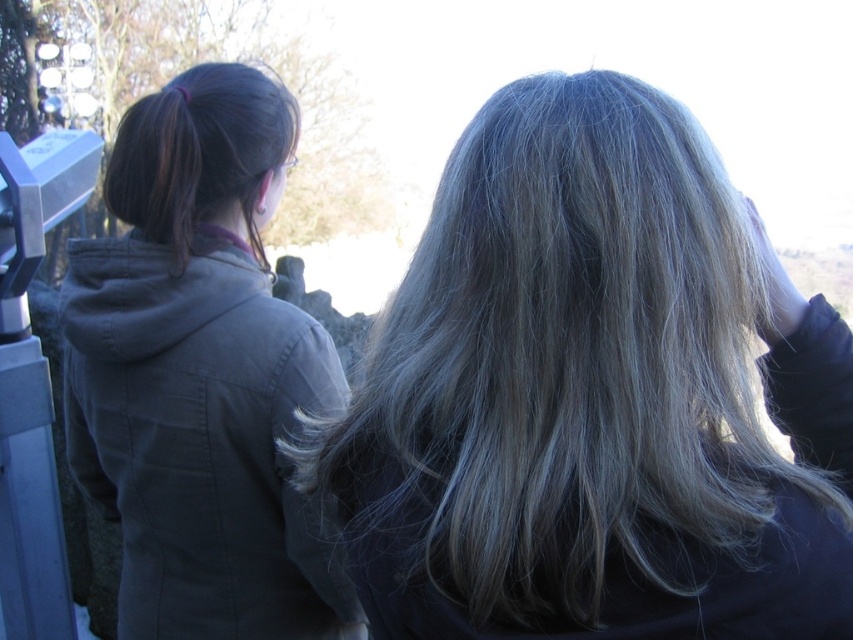
You are a photographer trying to capture a closeup of the dark gray hoodie at left and the dark brown silky hair at upper left. Which object should you focus on first to ensure both are in focus?

The dark gray hoodie at left is closer to the viewer than the dark brown silky hair at upper left, so you should focus on the dark gray hoodie at left first to ensure both are in focus.

You are a photographer adjusting your camera settings to focus on two points in the image. The first point is point (300,333) and the second is point (209,100). Since you can only focus on one point at a time, which point should you choose to ensure the closer one is sharp?

Point (300,333) is closer to the camera than point (209,100), so you should focus on point (300,333) to ensure the closer one is sharp.

You are a photographer adjusting your camera to focus on two points in the image. The first point is at coordinates point (688, 564) and the second is at point (247, 65). Which point should you focus on first if you want to ensure the closest object is in sharp focus?

Point (688, 564) is closer to the camera than point (247, 65), so you should focus on point (688, 564) first to ensure the closest object is in sharp focus.